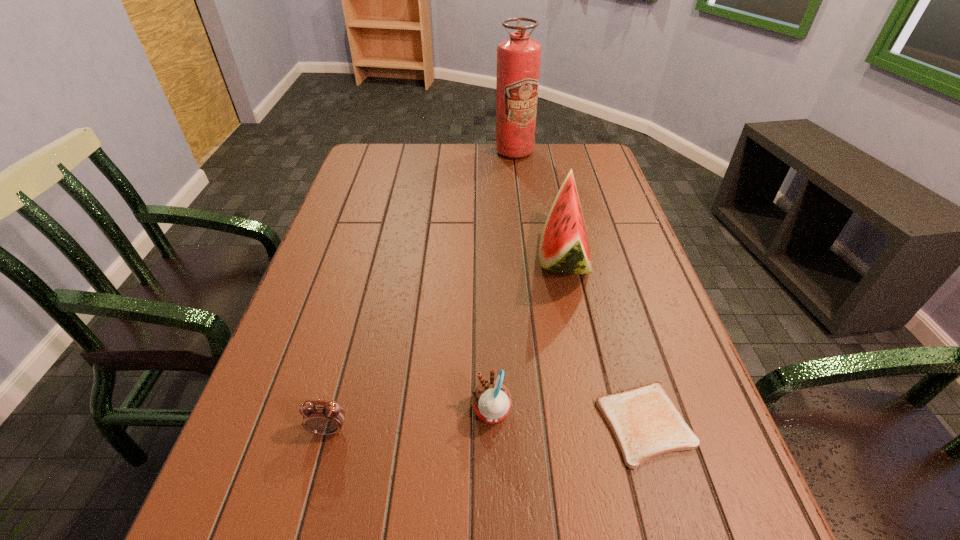
In the image, there is a desktop. Identify the location of vacant space at the far edge. (537, 160).

The width and height of the screenshot is (960, 540). What are the coordinates of `free space at the left edge of the desktop` in the screenshot? It's located at (323, 254).

Find the location of a particular element. The image size is (960, 540). free space at the right edge of the desktop is located at coordinates (692, 362).

Where is `free region at the far left corner of the desktop`? This screenshot has width=960, height=540. free region at the far left corner of the desktop is located at coordinates (395, 158).

Find the location of a particular element. This screenshot has width=960, height=540. vacant position at the far right corner of the desktop is located at coordinates pyautogui.click(x=576, y=144).

Where is `unoccupied area between the fourth nearest object and the leftmost object`? This screenshot has height=540, width=960. unoccupied area between the fourth nearest object and the leftmost object is located at coordinates (446, 343).

Locate an element on the screen. unoccupied position between the fire extinguisher and the alarm clock is located at coordinates (421, 291).

Locate an element on the screen. This screenshot has width=960, height=540. unoccupied area between the leftmost object and the fire extinguisher is located at coordinates (421, 291).

You are a GUI agent. You are given a task and a screenshot of the screen. Output one action in this format:
    pyautogui.click(x=<x>, y=<y>)
    Task: Click on the vacant area that lies between the fire extinguisher and the toast
    This screenshot has width=960, height=540.
    Given the screenshot: What is the action you would take?
    pyautogui.click(x=580, y=288)

Locate an element on the screen. free spot between the leftmost object and the watermelon is located at coordinates (446, 343).